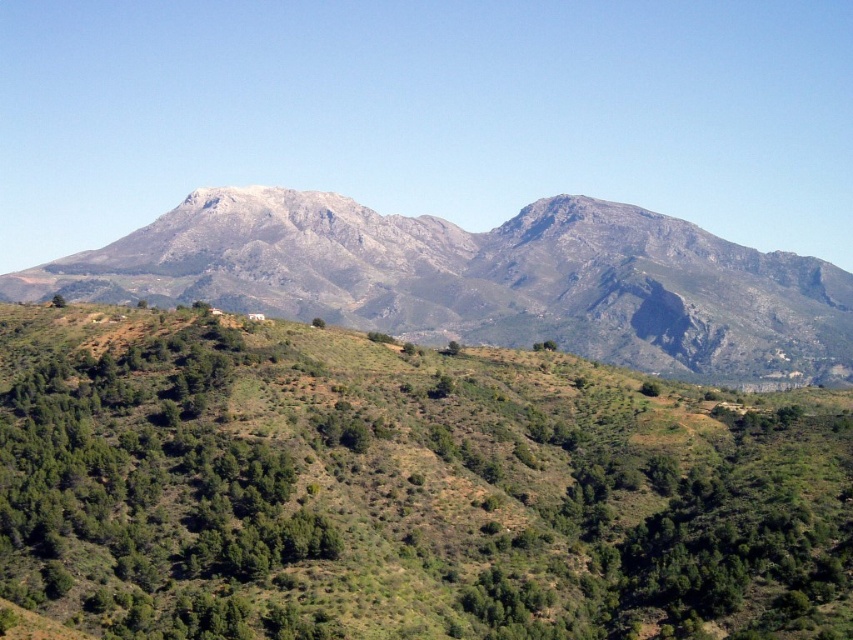
Question: Does gray rocky mountain at center appear over green leafy shrub at center-left?

Choices:
 (A) yes
 (B) no

Answer: (A)

Question: Which point is farther to the camera?

Choices:
 (A) (56, 307)
 (B) (73, 552)

Answer: (A)

Question: Which is farther from the green leafy tree at lower left?

Choices:
 (A) gray rocky mountain range at center
 (B) green leafy tree at center
 (C) gray rocky mountain at center
 (D) green leafy shrub at center-left

Answer: (A)

Question: In this image, where is green leafy tree at lower left located relative to green leafy tree at center?

Choices:
 (A) above
 (B) below

Answer: (A)

Question: Does green leafy shrub at center-left have a lesser width compared to green leafy tree at lower left?

Choices:
 (A) no
 (B) yes

Answer: (B)

Question: Estimate the real-world distances between objects in this image. Which object is closer to the gray rocky mountain range at center?

Choices:
 (A) green leafy tree at center
 (B) green leafy tree at lower left
 (C) green leafy shrub at center-left

Answer: (A)